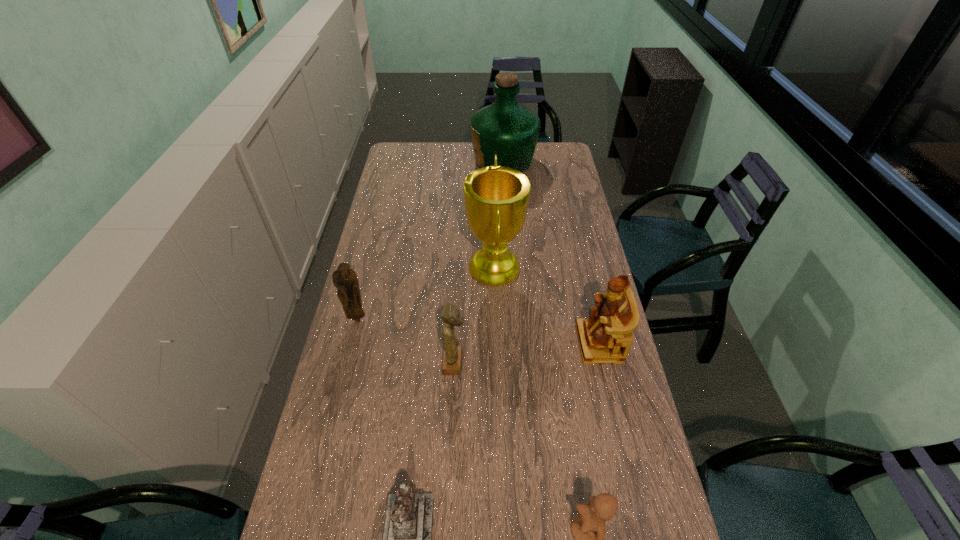
Point out which figurine is positioned as the fifth nearest to the second farthest object. Please provide its 2D coordinates. Your answer should be formatted as a tuple, i.e. [(x, y)], where the tuple contains the x and y coordinates of a point satisfying the conditions above.

[(588, 528)]

Identify the location of figurine that is the third closest one to the farthest object. (452, 354).